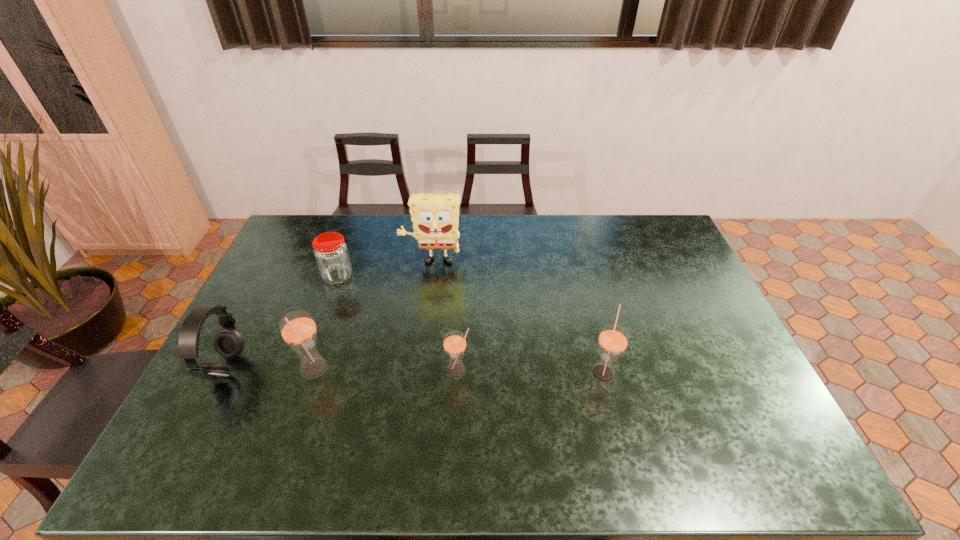
Find the location of a particular element. the third closest straw to the leftmost object is located at coordinates (613, 339).

Identify which straw is located as the third nearest to the sponge. Please provide its 2D coordinates. Your answer should be formatted as a tuple, i.e. [(x, y)], where the tuple contains the x and y coordinates of a point satisfying the conditions above.

[(613, 339)]

Identify the location of vacant space that satisfies the following two spatial constraints: 1. on the ear cups of the shortest straw; 2. on the left side of the earphone. The width and height of the screenshot is (960, 540). (225, 371).

This screenshot has height=540, width=960. Identify the location of free space that satisfies the following two spatial constraints: 1. on the face of the sponge; 2. on the ear cups of the earphone. (419, 368).

Where is `vacant space that satisfies the following two spatial constraints: 1. on the ear cups of the leftmost object; 2. on the right side of the leftmost straw`? The width and height of the screenshot is (960, 540). vacant space that satisfies the following two spatial constraints: 1. on the ear cups of the leftmost object; 2. on the right side of the leftmost straw is located at coordinates (226, 370).

The height and width of the screenshot is (540, 960). What are the coordinates of `vacant region that satisfies the following two spatial constraints: 1. on the front side of the jar; 2. on the right side of the shortest straw` in the screenshot? It's located at click(304, 371).

Image resolution: width=960 pixels, height=540 pixels. In order to click on vacant area that satisfies the following two spatial constraints: 1. on the ear cups of the leftmost object; 2. on the right side of the leftmost straw in this screenshot , I will do `click(226, 370)`.